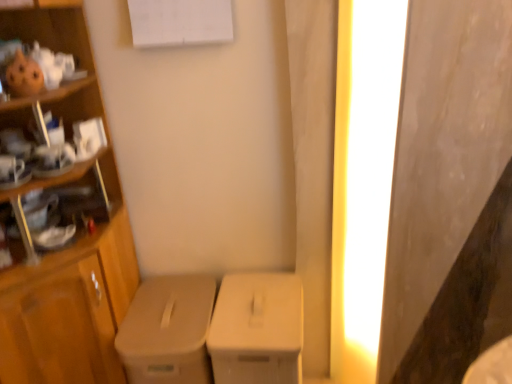
Question: Does matte beige cardboard box at center, which appears as the first cardboard box when viewed from the left, turn towards bright yellow light at right?

Choices:
 (A) no
 (B) yes

Answer: (A)

Question: Is matte beige cardboard box at center, arranged as the second cardboard box when viewed from the right, facing away from bright yellow light at right?

Choices:
 (A) no
 (B) yes

Answer: (A)

Question: From the image's perspective, is matte beige cardboard box at center, arranged as the second cardboard box when viewed from the right, located beneath bright yellow light at right?

Choices:
 (A) yes
 (B) no

Answer: (A)

Question: Is the depth of matte beige cardboard box at center, which appears as the first cardboard box when viewed from the left, less than that of bright yellow light at right?

Choices:
 (A) yes
 (B) no

Answer: (B)

Question: From a real-world perspective, is matte beige cardboard box at center, which appears as the first cardboard box when viewed from the left, located higher than bright yellow light at right?

Choices:
 (A) yes
 (B) no

Answer: (B)

Question: In the image, is wooden cabinet at left positioned in front of or behind matte beige cardboard box at center, arranged as the second cardboard box when viewed from the right?

Choices:
 (A) front
 (B) behind

Answer: (A)

Question: Visually, is wooden cabinet at left positioned to the left or to the right of matte beige cardboard box at center, arranged as the second cardboard box when viewed from the right?

Choices:
 (A) right
 (B) left

Answer: (B)

Question: From a real-world perspective, relative to matte beige cardboard box at center, which appears as the first cardboard box when viewed from the left, is wooden cabinet at left vertically above or below?

Choices:
 (A) above
 (B) below

Answer: (A)

Question: Considering the positions of point (104, 276) and point (214, 286), is point (104, 276) closer or farther from the camera than point (214, 286)?

Choices:
 (A) closer
 (B) farther

Answer: (A)

Question: Relative to wooden cabinet at left, is bright yellow light at right in front or behind?

Choices:
 (A) front
 (B) behind

Answer: (B)

Question: From the image's perspective, is bright yellow light at right located above or below wooden cabinet at left?

Choices:
 (A) below
 (B) above

Answer: (B)

Question: Is point (391, 16) positioned closer to the camera than point (10, 201)?

Choices:
 (A) closer
 (B) farther

Answer: (B)

Question: Is bright yellow light at right spatially inside wooden cabinet at left, or outside of it?

Choices:
 (A) outside
 (B) inside

Answer: (A)

Question: Which is correct: white matte cardboard box at center, marked as the 2th cardboard box in a left-to-right arrangement, is inside bright yellow light at right, or outside of it?

Choices:
 (A) inside
 (B) outside

Answer: (B)

Question: Would you say white matte cardboard box at center, marked as the 2th cardboard box in a left-to-right arrangement, is to the left or to the right of bright yellow light at right in the picture?

Choices:
 (A) right
 (B) left

Answer: (B)